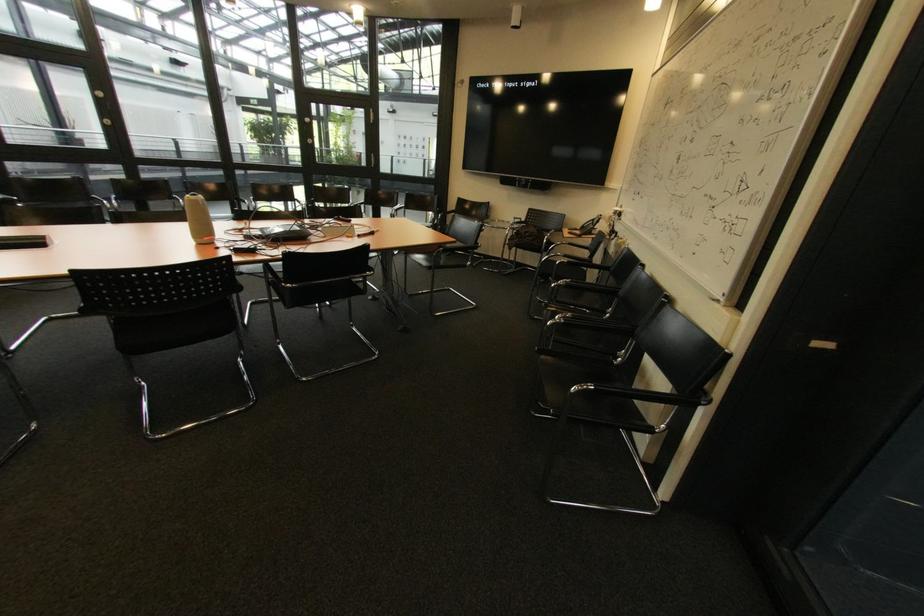
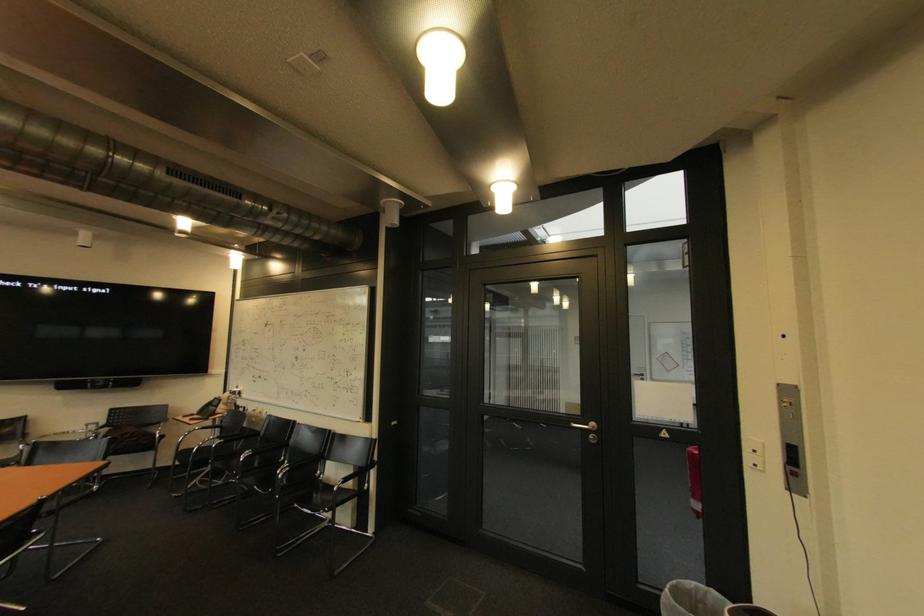
Find the pixel in the second image that matches pixel 553 233 in the first image.

(152, 430)